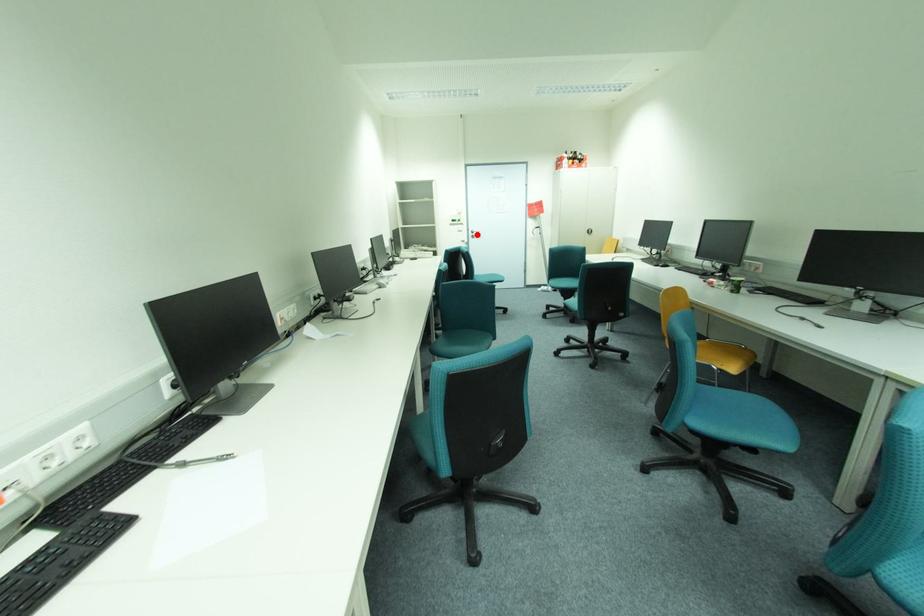
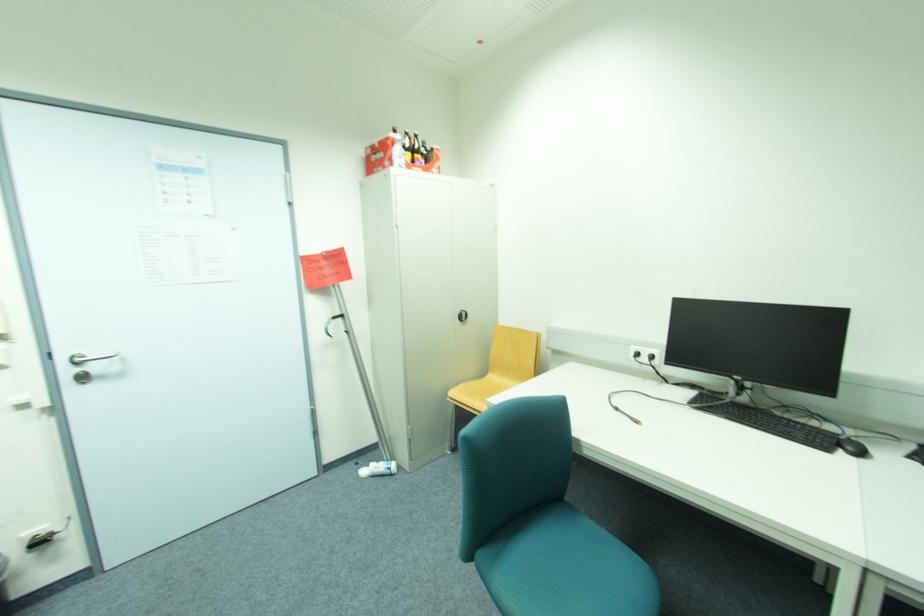
Question: I am providing you with two images of the same scene from different viewpoints. Given a red point in image1, look at the same physical point in image2. Is it:

Choices:
 (A) Closer to the viewpoint
 (B) Farther from the viewpoint

Answer: (B)